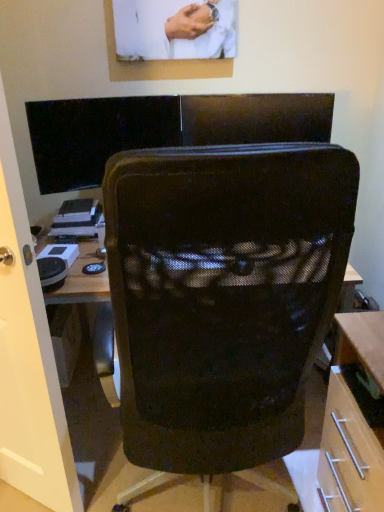
Question: Is black glossy monitor at upper left thinner than black mesh chair at center?

Choices:
 (A) no
 (B) yes

Answer: (B)

Question: Does black glossy monitor at upper left appear on the right side of black mesh chair at center?

Choices:
 (A) yes
 (B) no

Answer: (B)

Question: Can you confirm if black glossy monitor at upper left is shorter than black mesh chair at center?

Choices:
 (A) yes
 (B) no

Answer: (A)

Question: Is black glossy monitor at upper left positioned with its back to black mesh chair at center?

Choices:
 (A) no
 (B) yes

Answer: (A)

Question: From the image's perspective, does black glossy monitor at upper left appear lower than black mesh chair at center?

Choices:
 (A) no
 (B) yes

Answer: (A)

Question: Considering their positions, is black glossy monitor at upper left located in front of or behind black mesh chair at center?

Choices:
 (A) front
 (B) behind

Answer: (B)

Question: Would you say black glossy monitor at upper left is inside or outside black mesh chair at center?

Choices:
 (A) outside
 (B) inside

Answer: (A)

Question: Is point (64, 118) positioned closer to the camera than point (221, 145)?

Choices:
 (A) closer
 (B) farther

Answer: (B)

Question: Visually, is black glossy monitor at upper left positioned to the left or to the right of black mesh chair at center?

Choices:
 (A) left
 (B) right

Answer: (A)

Question: From a real-world perspective, relative to black glossy monitor at upper left, is transparent glass door at left vertically above or below?

Choices:
 (A) below
 (B) above

Answer: (A)

Question: Is point (26, 456) positioned closer to the camera than point (177, 115)?

Choices:
 (A) farther
 (B) closer

Answer: (B)

Question: Looking at their shapes, would you say transparent glass door at left is wider or thinner than black glossy monitor at upper left?

Choices:
 (A) wide
 (B) thin

Answer: (A)

Question: From the image's perspective, is transparent glass door at left positioned above or below black glossy monitor at upper left?

Choices:
 (A) above
 (B) below

Answer: (B)

Question: In terms of width, does transparent glass door at left look wider or thinner when compared to black mesh chair at center?

Choices:
 (A) wide
 (B) thin

Answer: (B)

Question: Considering the positions of point (6, 413) and point (137, 369), is point (6, 413) closer or farther from the camera than point (137, 369)?

Choices:
 (A) closer
 (B) farther

Answer: (B)